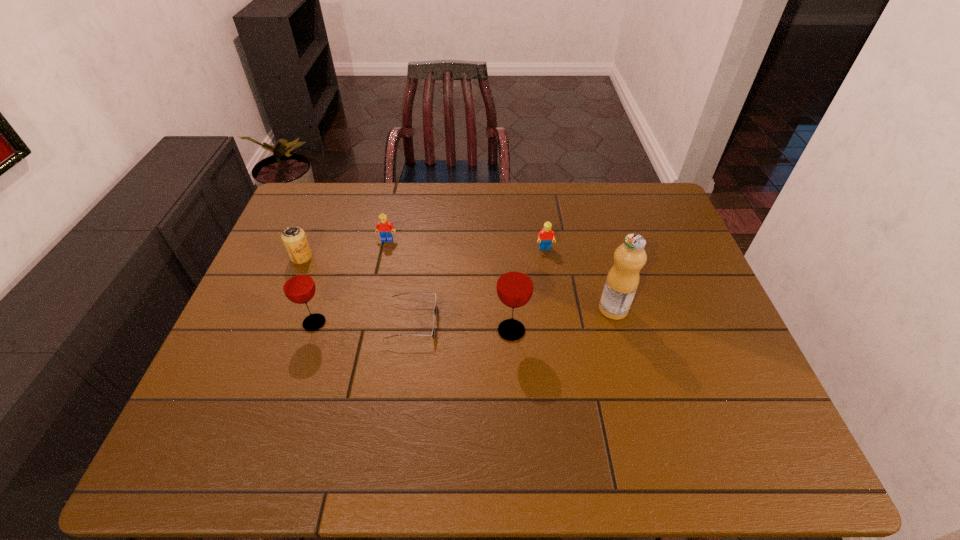
Locate an element on the screen. This screenshot has height=540, width=960. vacant point that satisfies the following two spatial constraints: 1. on the front label of the rightmost object; 2. on the front side of the second object from left to right is located at coordinates (617, 323).

The image size is (960, 540). What are the coordinates of `vacant area that satisfies the following two spatial constraints: 1. on the face of the third object from right to left; 2. on the left side of the farther Lego` in the screenshot? It's located at (367, 331).

What are the coordinates of `vacant area in the image that satisfies the following two spatial constraints: 1. on the face of the nearer Lego; 2. on the front-facing side of the fourth object from left to right` in the screenshot? It's located at (556, 322).